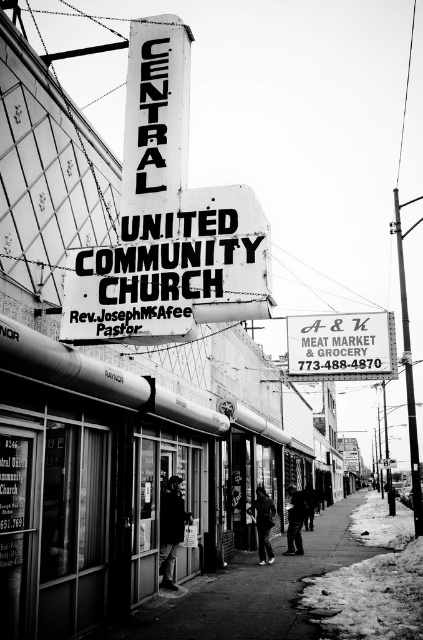
Question: Observing the image, what is the correct spatial positioning of dark fabric coat at center in reference to dark gray jacket at center?

Choices:
 (A) right
 (B) left

Answer: (B)

Question: Considering the relative positions of smooth concrete sidewalk at center and dark clothing at center in the image provided, where is smooth concrete sidewalk at center located with respect to dark clothing at center?

Choices:
 (A) right
 (B) left

Answer: (A)

Question: Does white plastic sign at center appear on the left side of dark gray jacket at center?

Choices:
 (A) yes
 (B) no

Answer: (B)

Question: Which point is closer to the camera taking this photo?

Choices:
 (A) (299, 508)
 (B) (233, 636)
 (C) (373, 317)

Answer: (B)

Question: Which of the following is the farthest from the observer?

Choices:
 (A) dark gray jacket at center
 (B) dark clothing at center
 (C) white painted metal sign at center
 (D) dark fabric coat at center

Answer: (A)

Question: Considering the real-world distances, which object is closest to the dark clothing figure at center?

Choices:
 (A) smooth concrete sidewalk at center
 (B) dark gray jacket at center

Answer: (B)